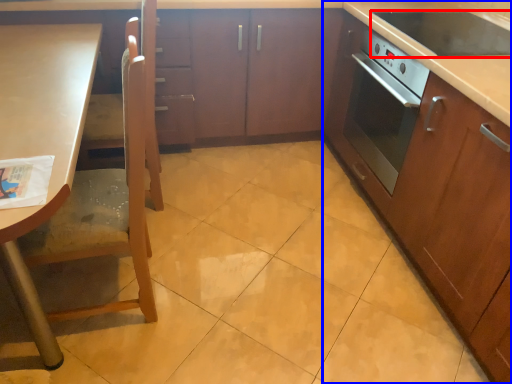
Question: Which object is further to the camera taking this photo, kitchen appliance (highlighted by a red box) or cabinetry (highlighted by a blue box)?

Choices:
 (A) kitchen appliance
 (B) cabinetry

Answer: (A)